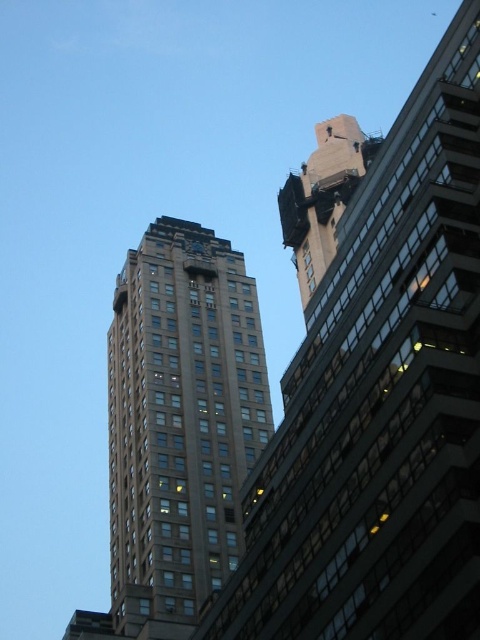
You are standing in front of the two buildings and want to take a photo that includes both points. Which point, point (x=363, y=440) or point (x=182, y=364), is closer to you?

Point (x=363, y=440) is closer to the camera than point (x=182, y=364).

You are standing in the middle of the street looking up at the two buildings. Which object, the brown glassy building at upper left or the metallic clock at upper center, is closer to you?

The brown glassy building at upper left is closer to you because it is in front of the metallic clock at upper center.

You are standing at the point marked by the coordinates point (382, 401) in the image. Looking around, you see the brown glassy building at upper left. Which direction should you face to see the building on the right with a dark gray facade?

You should face towards the right direction from the point (382, 401) to see the building on the right with a dark gray facade.